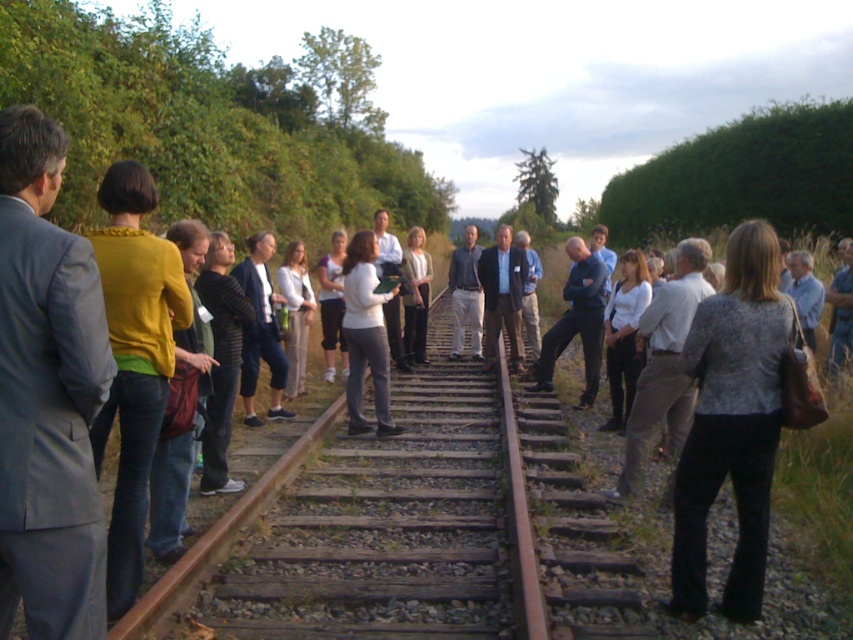
Is point (462, 268) farther from camera compared to point (376, 275)?

Yes.

At what (x,y) coordinates should I click in order to perform the action: click on light brown pants at center. Please return your answer as a coordinate pair (x, y). This screenshot has height=640, width=853. Looking at the image, I should click on (465, 294).

Which is below, matte yellow sweater at left or white fabric at center?

Positioned lower is matte yellow sweater at left.

Between point (125, 483) and point (393, 246), which one is positioned behind?

The point (393, 246) is behind.

Is point (120, 333) less distant than point (392, 243)?

Yes, point (120, 333) is in front of point (392, 243).

Where is `matte yellow sweater at left`? matte yellow sweater at left is located at coordinates (134, 360).

Does light brown suit at center appear under light brown pants at center?

No.

Is light brown suit at center smaller than light brown pants at center?

No, light brown suit at center is not smaller than light brown pants at center.

Does point (485, 284) come closer to viewer compared to point (461, 250)?

Yes, point (485, 284) is closer to viewer.

Identify the location of light brown suit at center. The height and width of the screenshot is (640, 853). (502, 296).